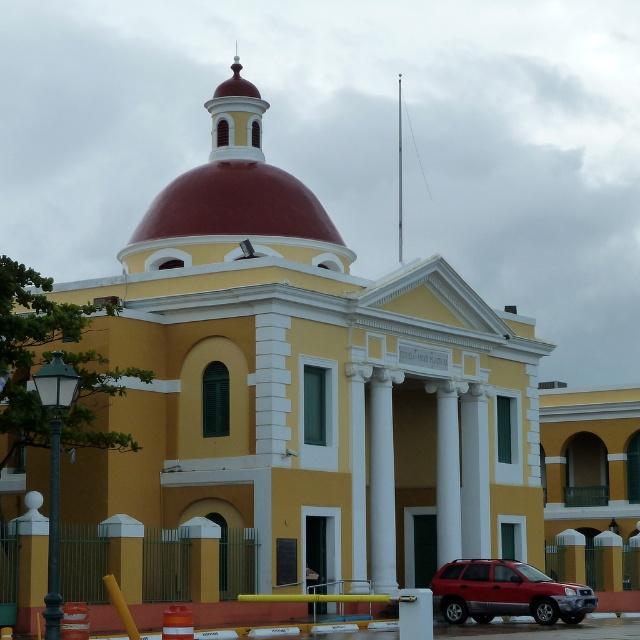
You are a photographer planning to capture the entire building and its surroundings. Given the presence of the metallic red suv at lower right and the smooth red dome at upper center, which object should you ensure is fully visible in your shot to maintain the building facade symmetry?

The smooth red dome at upper center should be fully visible in the shot because it is a central architectural feature of the building and occupies more space than the metallic red suv at lower right, which is smaller and located near the entrance.

You are a delivery person trying to park your truck which is 2.5 meters tall. You see the metallic red suv at lower right and the white marble column at center. Can your truck pass between them without hitting the column?

The metallic red suv at lower right is taller than the white marble column at center. Since the truck is 2.5 meters tall, it may hit the metallic red suv at lower right if it is taller than 2.5 meters. However, the column is shorter, so the truck can pass between them without hitting the column as long as there is enough space horizontally.

You are standing in front of the yellow building with the red dome and want to walk towards the two points marked on the ground. Which point, point (436,593) or point (388,496), will you reach first?

Point (436,593) is closer to the viewer, so you will reach it first.